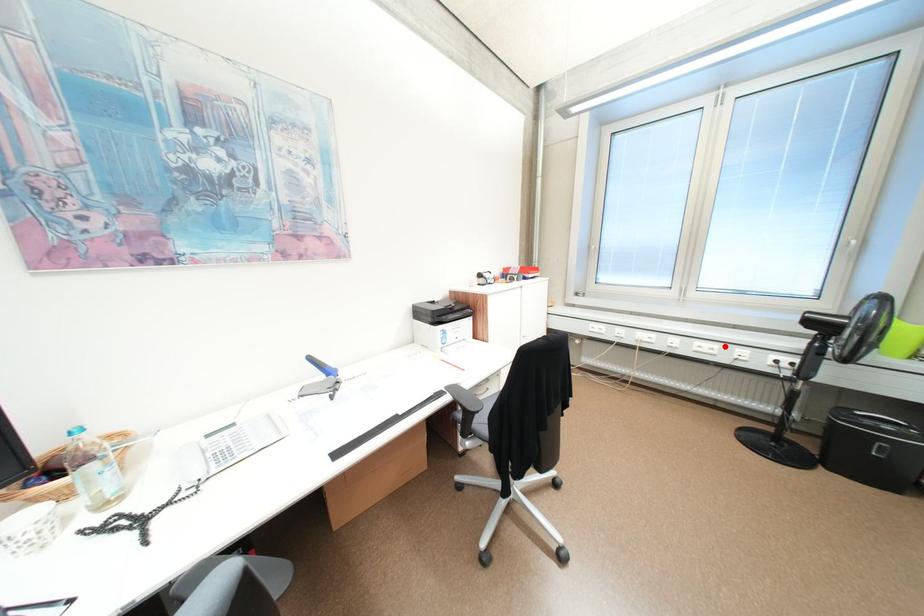
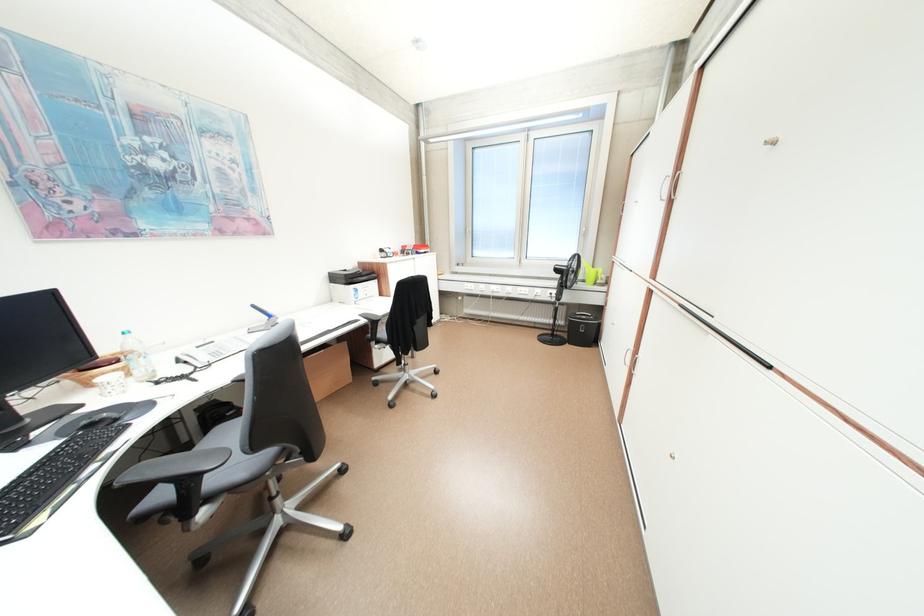
Locate, in the second image, the point that corresponds to the highlighted location in the first image.

(537, 290)